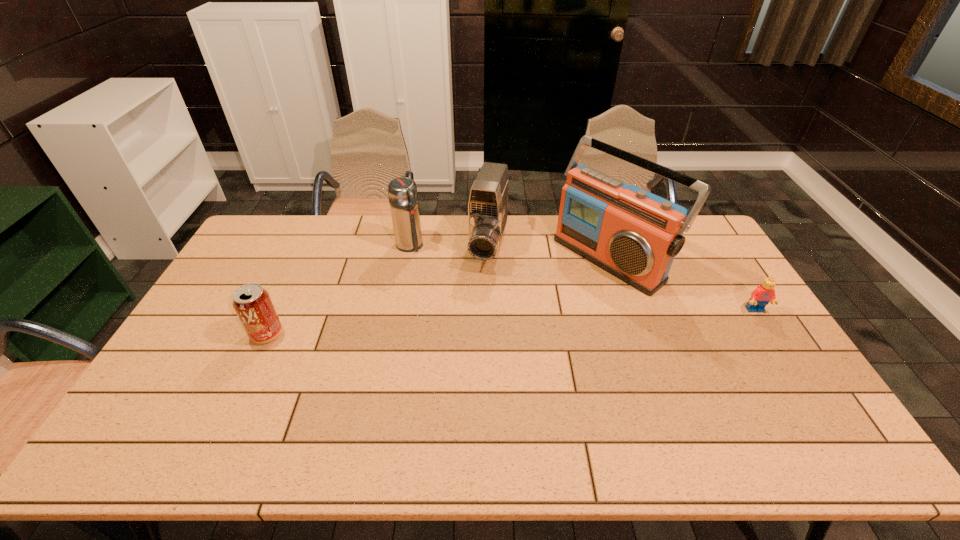
Where is `vacant spot on the desktop that is between the second shortest object and the Lego and is positioned with a handle on the side of the second object from left to right`? vacant spot on the desktop that is between the second shortest object and the Lego and is positioned with a handle on the side of the second object from left to right is located at coordinates (483, 323).

You are a GUI agent. You are given a task and a screenshot of the screen. Output one action in this format:
    pyautogui.click(x=<x>, y=<y>)
    Task: Click on the free space on the desktop that is between the nearest object and the shortest object and is positioned at the front of the camcorder, highlighting the lens
    This screenshot has height=540, width=960.
    Given the screenshot: What is the action you would take?
    pyautogui.click(x=462, y=325)

The image size is (960, 540). Find the location of `free space on the desktop that is between the soda can and the Lego and is positioned on the front-facing side of the radio receiver`. free space on the desktop that is between the soda can and the Lego and is positioned on the front-facing side of the radio receiver is located at coordinates (521, 322).